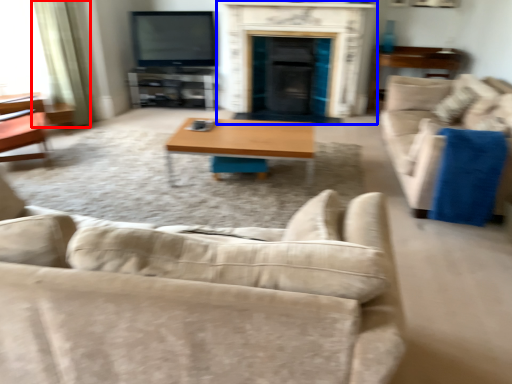
Question: Which of the following is the farthest to the observer, curtain (highlighted by a red box) or fireplace (highlighted by a blue box)?

Choices:
 (A) curtain
 (B) fireplace

Answer: (B)